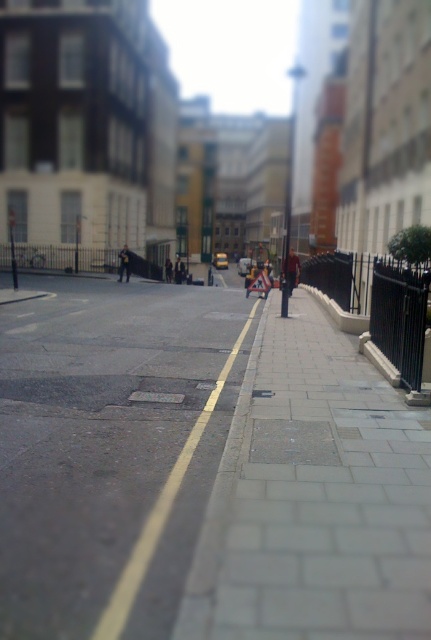
You are a delivery person carrying a package and need to place it on the sidewalk between the dark blue jeans at center and the dark brown leather jacket at center. Which object should you place the package closer to so that it doesn not exceed the sidewalk width?

The dark blue jeans at center is wider than the dark brown leather jacket at center. Therefore, placing the package closer to the dark brown leather jacket at center would ensure it stays within the sidewalk width.

You are a pedestrian standing on the sidewalk next to the black metal fence. You see a person wearing a red jacket at center and dark blue jeans at center. Which clothing item is covering the other?

The red jacket at center is positioned over dark blue jeans at center, meaning the jacket is covering the jeans.